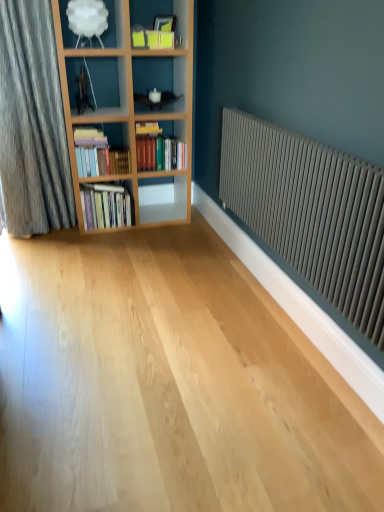
The image size is (384, 512). Describe the element at coordinates (105, 206) in the screenshot. I see `hardcover books at left, which is the 3th book in top-to-bottom order` at that location.

You are a GUI agent. You are given a task and a screenshot of the screen. Output one action in this format:
    pyautogui.click(x=<x>, y=<y>)
    Task: Click on the hardcover books at left, which is the 3th book in top-to-bottom order
    The width and height of the screenshot is (384, 512).
    Given the screenshot: What is the action you would take?
    pyautogui.click(x=105, y=206)

In order to click on white matte lampshade at upper left, marked as the 2th shelf in a bottom-to-top arrangement in this screenshot , I will do pos(112,25).

Image resolution: width=384 pixels, height=512 pixels. Describe the element at coordinates (310, 213) in the screenshot. I see `matte gray radiator at right` at that location.

Measure the distance between point (x=159, y=137) and camera.

They are 10.37 feet apart.

What do you see at coordinates (162, 199) in the screenshot?
I see `white glossy shelf at center, which ranks as the first shelf in right-to-left order` at bounding box center [162, 199].

What do you see at coordinates (98, 154) in the screenshot? The height and width of the screenshot is (512, 384). I see `hardcover books at left, placed as the second book when sorted from top to bottom` at bounding box center [98, 154].

Where is `hardcover books at left, which is the 3th book in top-to-bottom order`? This screenshot has width=384, height=512. hardcover books at left, which is the 3th book in top-to-bottom order is located at coordinates (105, 206).

Considering the positions of objects hardcover books at center, the first book positioned from the top, and hardcover books at left, the 2th book from the bottom, in the image provided, who is in front, hardcover books at center, the first book positioned from the top, or hardcover books at left, the 2th book from the bottom,?

hardcover books at left, the 2th book from the bottom.

Measure the distance between hardcover books at center, the first book positioned from the top, and hardcover books at left, the 2th book from the bottom.

hardcover books at center, the first book positioned from the top, is 10.52 inches away from hardcover books at left, the 2th book from the bottom.

Consider the image. Considering the relative sizes of hardcover books at center, the third book when ordered from bottom to top, and hardcover books at left, placed as the second book when sorted from top to bottom, in the image provided, is hardcover books at center, the third book when ordered from bottom to top, bigger than hardcover books at left, placed as the second book when sorted from top to bottom,?

Yes.

Which of these two, hardcover books at center, the first book positioned from the top, or hardcover books at left, placed as the second book when sorted from top to bottom, is thinner?

Thinner between the two is hardcover books at left, placed as the second book when sorted from top to bottom.

Does point (70, 42) appear closer or farther from the camera than point (97, 168)?

Point (70, 42) is positioned closer to the camera compared to point (97, 168).

From the image's perspective, which object appears higher, white matte lampshade at upper left, the 1th shelf when ordered from top to bottom, or hardcover books at left, the 2th book from the bottom?

white matte lampshade at upper left, the 1th shelf when ordered from top to bottom.

Is white matte lampshade at upper left, placed as the 2th shelf when sorted from back to front, thinner than hardcover books at left, the 2th book from the bottom?

Incorrect, the width of white matte lampshade at upper left, placed as the 2th shelf when sorted from back to front, is not less than that of hardcover books at left, the 2th book from the bottom.

Does white matte lampshade at upper left, placed as the 2th shelf when sorted from back to front, lie in front of hardcover books at left, the 2th book from the bottom?

Yes, white matte lampshade at upper left, placed as the 2th shelf when sorted from back to front, is closer to the camera.

Considering the sizes of objects white glossy shelf at center, which appears as the 1th shelf when ordered from the bottom, and hardcover books at left, marked as the 1th book in a bottom-to-top arrangement, in the image provided, who is shorter, white glossy shelf at center, which appears as the 1th shelf when ordered from the bottom, or hardcover books at left, marked as the 1th book in a bottom-to-top arrangement,?

Standing shorter between the two is white glossy shelf at center, which appears as the 1th shelf when ordered from the bottom.

Choose the correct answer: Is white glossy shelf at center, which ranks as the first shelf in right-to-left order, inside hardcover books at left, marked as the 1th book in a bottom-to-top arrangement, or outside it?

white glossy shelf at center, which ranks as the first shelf in right-to-left order, exists outside the volume of hardcover books at left, marked as the 1th book in a bottom-to-top arrangement.

Considering the sizes of white glossy shelf at center, acting as the 2th shelf starting from the front, and hardcover books at left, marked as the 1th book in a bottom-to-top arrangement, in the image, is white glossy shelf at center, acting as the 2th shelf starting from the front, wider or thinner than hardcover books at left, marked as the 1th book in a bottom-to-top arrangement,?

Clearly, white glossy shelf at center, acting as the 2th shelf starting from the front, has less width compared to hardcover books at left, marked as the 1th book in a bottom-to-top arrangement.

Is point (151, 169) positioned behind point (247, 165)?

Yes, it is behind point (247, 165).

Is hardcover books at center, the first book positioned from the top, in front of or behind matte gray radiator at right in the image?

hardcover books at center, the first book positioned from the top, is behind matte gray radiator at right.

From a real-world perspective, who is located higher, hardcover books at center, the third book when ordered from bottom to top, or matte gray radiator at right?

hardcover books at center, the third book when ordered from bottom to top, is physically above.

Between white glossy shelf at center, the 2th shelf viewed from the top, and hardcover books at center, the first book positioned from the top, which one appears on the right side from the viewer's perspective?

white glossy shelf at center, the 2th shelf viewed from the top.

At what (x,y) coordinates should I click in order to perform the action: click on shelf located below the hardcover books at center, the first book positioned from the top (from the image's perspective). Please return your answer as a coordinate pair (x, y). This screenshot has width=384, height=512. Looking at the image, I should click on (162, 199).

From the picture: How different are the orientations of white glossy shelf at center, the 2th shelf viewed from the top, and hardcover books at center, the third book when ordered from bottom to top, in degrees?

The angular difference between white glossy shelf at center, the 2th shelf viewed from the top, and hardcover books at center, the third book when ordered from bottom to top, is 0.128 degrees.

How much distance is there between white glossy shelf at center, acting as the 2th shelf starting from the front, and hardcover books at center, the first book positioned from the top?

white glossy shelf at center, acting as the 2th shelf starting from the front, is 17.40 inches away from hardcover books at center, the first book positioned from the top.

What are the coordinates of `shelf lying in front of the hardcover books at center, the third book when ordered from bottom to top` in the screenshot? It's located at (112, 25).

Is hardcover books at center, the third book when ordered from bottom to top, positioned far away from white matte lampshade at upper left, marked as the 1th shelf in a front-to-back arrangement?

That's not correct — hardcover books at center, the third book when ordered from bottom to top, is a little close to white matte lampshade at upper left, marked as the 1th shelf in a front-to-back arrangement.

How different are the orientations of hardcover books at center, the first book positioned from the top, and white matte lampshade at upper left, placed as the 2th shelf when sorted from back to front, in degrees?

The angle between the facing direction of hardcover books at center, the first book positioned from the top, and the facing direction of white matte lampshade at upper left, placed as the 2th shelf when sorted from back to front, is 0.000237 degrees.

Is the position of hardcover books at center, the third book when ordered from bottom to top, more distant than that of white matte lampshade at upper left, marked as the 1th shelf in a front-to-back arrangement?

Yes, it is.

Based on the photo, who is shorter, white matte lampshade at upper left, placed as the 2th shelf when sorted from back to front, or hardcover books at center, the third book when ordered from bottom to top?

Standing shorter between the two is white matte lampshade at upper left, placed as the 2th shelf when sorted from back to front.

The height and width of the screenshot is (512, 384). I want to click on the 2nd book behind the white matte lampshade at upper left, the 1th shelf in the left-to-right sequence, so click(158, 149).

From the image's perspective, does white matte lampshade at upper left, the 1th shelf when ordered from top to bottom, appear lower than hardcover books at center, the first book positioned from the top?

No, from the image's perspective, white matte lampshade at upper left, the 1th shelf when ordered from top to bottom, is not below hardcover books at center, the first book positioned from the top.

Is white matte lampshade at upper left, marked as the 2th shelf in a bottom-to-top arrangement, not close to hardcover books at center, the third book when ordered from bottom to top?

They are positioned close to each other.

The width and height of the screenshot is (384, 512). In order to click on book that appears on the right of hardcover books at left, the 2th book from the bottom in this screenshot , I will do `click(158, 149)`.

I want to click on shelf that is on the left side of hardcover books at left, placed as the second book when sorted from top to bottom, so click(x=112, y=25).

Considering their positions, is hardcover books at left, placed as the second book when sorted from top to bottom, positioned closer to white glossy shelf at center, which ranks as the first shelf in right-to-left order, than matte gray radiator at right?

Among the two, hardcover books at left, placed as the second book when sorted from top to bottom, is located nearer to white glossy shelf at center, which ranks as the first shelf in right-to-left order.

Looking at the image, which one is located closer to hardcover books at center, the third book when ordered from bottom to top, white glossy shelf at center, the first shelf in the back-to-front sequence, or matte gray radiator at right?

white glossy shelf at center, the first shelf in the back-to-front sequence, lies closer to hardcover books at center, the third book when ordered from bottom to top, than the other object.

Which object lies nearer to the anchor point hardcover books at left, placed as the second book when sorted from top to bottom, white matte lampshade at upper left, marked as the 1th shelf in a front-to-back arrangement, or matte gray radiator at right?

white matte lampshade at upper left, marked as the 1th shelf in a front-to-back arrangement, is positioned closer to the anchor hardcover books at left, placed as the second book when sorted from top to bottom.

From the image, which object appears to be farther from white matte lampshade at upper left, placed as the 2th shelf when sorted from back to front, hardcover books at left, the 2th book from the bottom, or hardcover books at left, which is the 3th book in top-to-bottom order?

Based on the image, hardcover books at left, which is the 3th book in top-to-bottom order, appears to be further to white matte lampshade at upper left, placed as the 2th shelf when sorted from back to front.

Estimate the real-world distances between objects in this image. Which object is closer to hardcover books at left, the 2th book from the bottom, matte gray radiator at right or white glossy shelf at center, which appears as the 1th shelf when ordered from the bottom?

white glossy shelf at center, which appears as the 1th shelf when ordered from the bottom, is closer to hardcover books at left, the 2th book from the bottom.

Considering their positions, is hardcover books at left, which is the 3th book in top-to-bottom order, positioned further to white matte lampshade at upper left, the 1th shelf when ordered from top to bottom, than hardcover books at left, placed as the second book when sorted from top to bottom?

hardcover books at left, which is the 3th book in top-to-bottom order, lies further to white matte lampshade at upper left, the 1th shelf when ordered from top to bottom, than the other object.

Which object lies nearer to the anchor point hardcover books at center, the third book when ordered from bottom to top, matte gray radiator at right or hardcover books at left, placed as the second book when sorted from top to bottom?

hardcover books at left, placed as the second book when sorted from top to bottom.

Which object lies further to the anchor point matte gray radiator at right, white glossy shelf at center, which appears as the 1th shelf when ordered from the bottom, or hardcover books at left, the 2th book from the bottom?

white glossy shelf at center, which appears as the 1th shelf when ordered from the bottom, is further to matte gray radiator at right.

What are the coordinates of `shelf positioned between matte gray radiator at right and white glossy shelf at center, marked as the second shelf in a left-to-right arrangement, from near to far` in the screenshot? It's located at (112, 25).

Find the location of a particular element. The width and height of the screenshot is (384, 512). book between matte gray radiator at right and hardcover books at center, the third book when ordered from bottom to top, from front to back is located at coordinates (98, 154).

Locate an element on the screen. shelf between matte gray radiator at right and hardcover books at left, placed as the second book when sorted from top to bottom, from front to back is located at coordinates (112, 25).

This screenshot has width=384, height=512. What are the coordinates of `shelf between white matte lampshade at upper left, placed as the 2th shelf when sorted from back to front, and hardcover books at left, which is the 3th book in top-to-bottom order, from top to bottom` in the screenshot? It's located at [x=162, y=199].